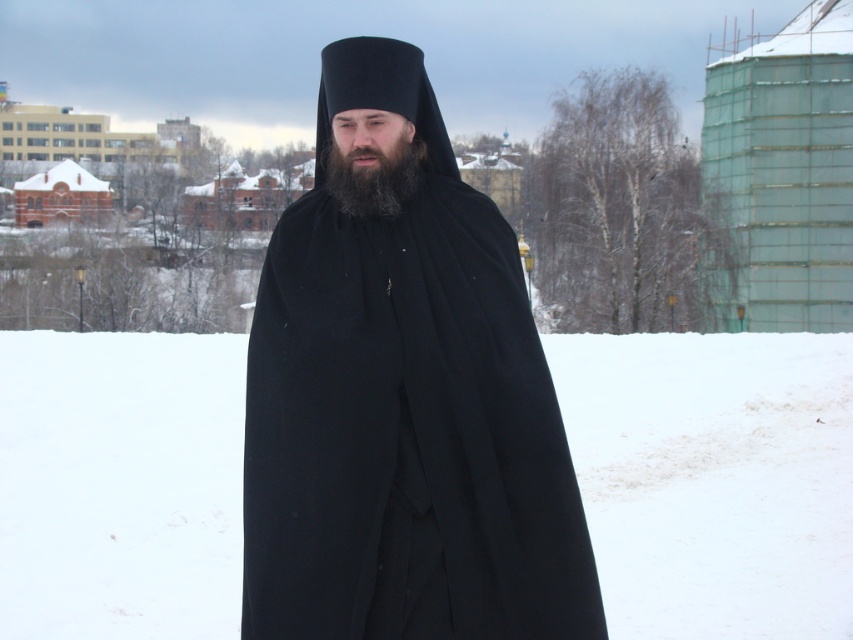
The height and width of the screenshot is (640, 853). What do you see at coordinates (714, 480) in the screenshot?
I see `white fluffy snow at center` at bounding box center [714, 480].

Is white fluffy snow at center positioned behind black woolen robe at center?

Yes.

The width and height of the screenshot is (853, 640). Describe the element at coordinates (714, 480) in the screenshot. I see `white fluffy snow at center` at that location.

Image resolution: width=853 pixels, height=640 pixels. In order to click on white fluffy snow at center in this screenshot , I will do `click(714, 480)`.

What do you see at coordinates (714, 480) in the screenshot? I see `white fluffy snow at center` at bounding box center [714, 480].

Can you confirm if white fluffy snow at center is smaller than black matte beard at center?

No, white fluffy snow at center is not smaller than black matte beard at center.

Does point (614, 464) come in front of point (338, 150)?

No, (614, 464) is further to viewer.

Image resolution: width=853 pixels, height=640 pixels. Find the location of `white fluffy snow at center`. white fluffy snow at center is located at coordinates (714, 480).

Which is more to the left, black woolen robe at center or black matte beard at center?

From the viewer's perspective, black matte beard at center appears more on the left side.

Is black woolen robe at center bigger than black matte beard at center?

Correct, black woolen robe at center is larger in size than black matte beard at center.

Does point (392, 58) come behind point (366, 196)?

Yes, it is behind point (366, 196).

Where is `black woolen robe at center`? This screenshot has height=640, width=853. black woolen robe at center is located at coordinates (403, 404).